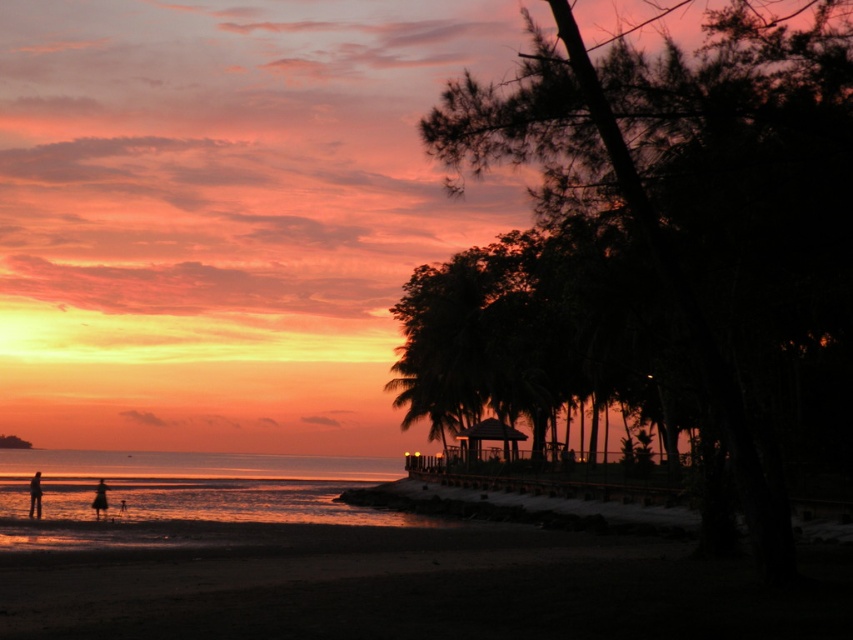
You are standing on the beach and want to take a photo of the sunset. You notice the dark sand at lower left and the sandy water at lower left. Which of these two areas is higher in elevation?

The dark sand at lower left is not as tall as the sandy water at lower left, so the sandy water at lower left is higher in elevation.

You are standing at the point marked as point (556, 605) and want to take a photo of the sunset. The camera you have can focus up to 50 feet away. Will the camera be able to focus on the sunset scene?

The distance of point (556, 605) from camera is 47.96 feet, which is within the camera focus range of 50 feet. Therefore, the camera can focus on the sunset scene.